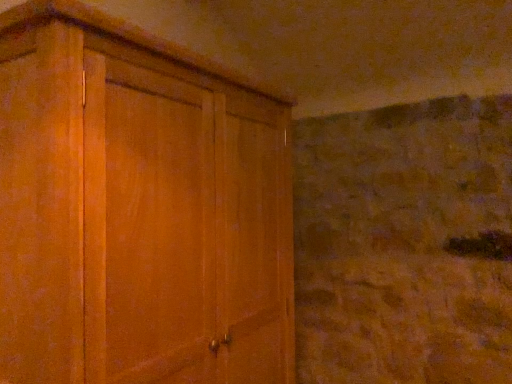
The width and height of the screenshot is (512, 384). Describe the element at coordinates (138, 209) in the screenshot. I see `matte wood cupboard at left` at that location.

This screenshot has height=384, width=512. I want to click on matte wood cupboard at left, so click(138, 209).

At what (x,y) coordinates should I click in order to perform the action: click on matte wood cupboard at left. Please return your answer as a coordinate pair (x, y). Image resolution: width=512 pixels, height=384 pixels. Looking at the image, I should click on (138, 209).